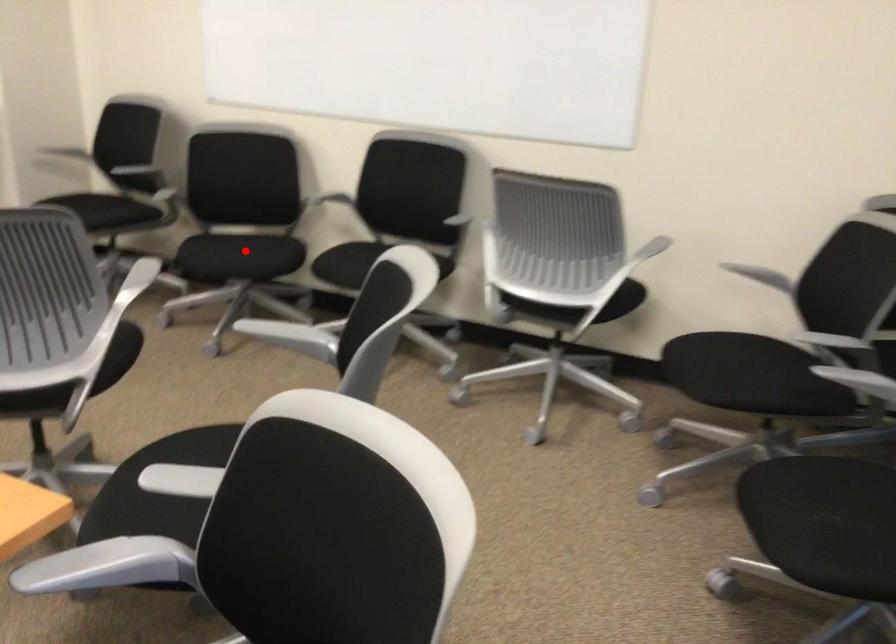
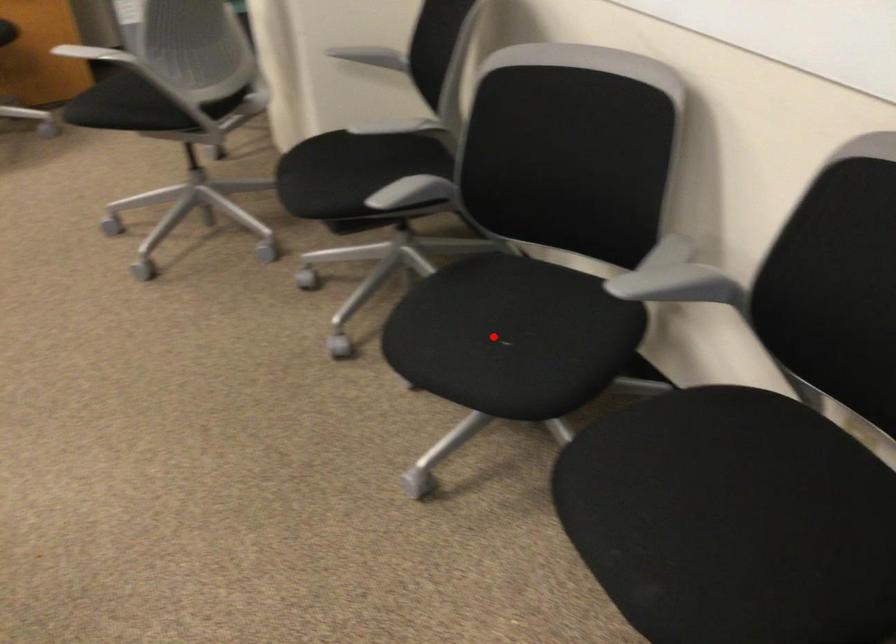
I am providing you with two images of the same scene from different viewpoints. A red point is marked on the first image and another point is marked on the second image. Is the marked point in image1 the same physical position as the marked point in image2?

Yes